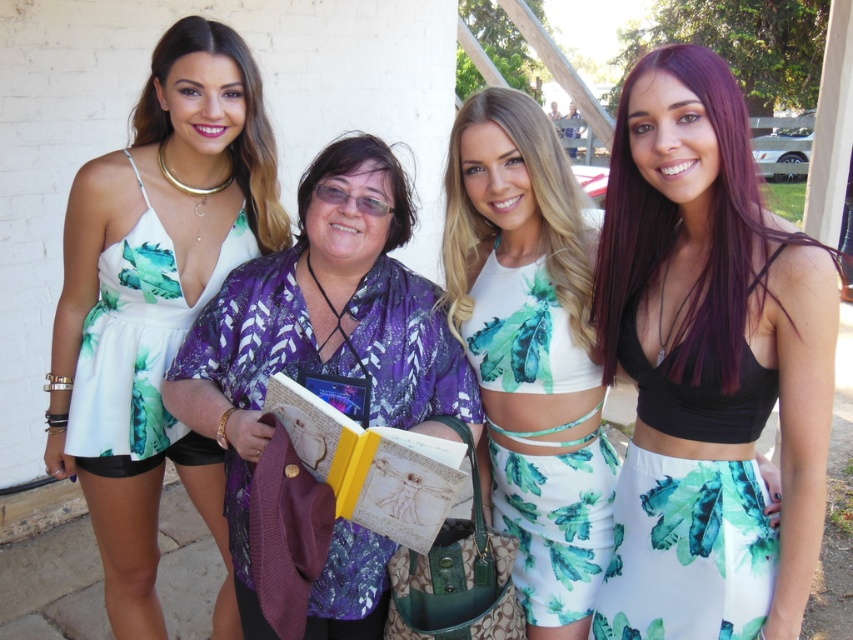
Is black matte crop top at right bigger than purple floral kimono at center?

Actually, black matte crop top at right might be smaller than purple floral kimono at center.

Who is shorter, black matte crop top at right or purple floral kimono at center?

purple floral kimono at center is shorter.

Image resolution: width=853 pixels, height=640 pixels. What do you see at coordinates (708, 365) in the screenshot?
I see `black matte crop top at right` at bounding box center [708, 365].

I want to click on black matte crop top at right, so click(708, 365).

Is the position of purple floral kimono at center more distant than that of white printed fabric top at center?

No, it is in front of white printed fabric top at center.

Is purple floral kimono at center bigger than white printed fabric top at center?

Yes, purple floral kimono at center is bigger than white printed fabric top at center.

The height and width of the screenshot is (640, 853). Identify the location of purple floral kimono at center. (322, 333).

In the scene shown: Is white floral fabric dress at left further to camera compared to matte gold necklace at upper left?

Yes, it is behind matte gold necklace at upper left.

Which is behind, point (73, 426) or point (169, 120)?

Positioned behind is point (73, 426).

At what (x,y) coordinates should I click in order to perform the action: click on white floral fabric dress at left. Please return your answer as a coordinate pair (x, y). The height and width of the screenshot is (640, 853). Looking at the image, I should click on (138, 342).

At what (x,y) coordinates should I click in order to perform the action: click on white floral fabric dress at left. Please return your answer as a coordinate pair (x, y). Looking at the image, I should click on (138, 342).